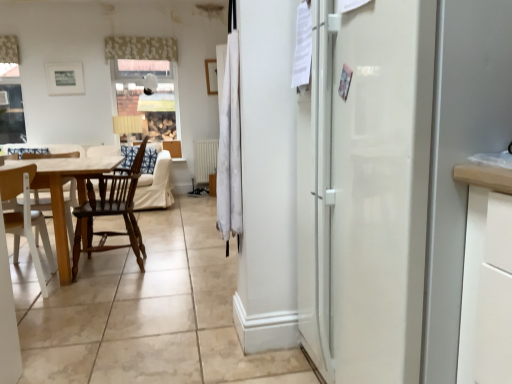
Question: Should I look upward or downward to see white floral fabric at upper center, acting as the second curtain starting from the front?

Choices:
 (A) down
 (B) up

Answer: (B)

Question: Can you confirm if wooden table at left is bigger than dark brown wood chair at left, which ranks as the 2th chair in left-to-right order?

Choices:
 (A) yes
 (B) no

Answer: (A)

Question: Is wooden table at left facing towards dark brown wood chair at left, which ranks as the 2th chair in left-to-right order?

Choices:
 (A) yes
 (B) no

Answer: (B)

Question: Is the position of wooden table at left less distant than that of dark brown wood chair at left, which ranks as the 2th chair in left-to-right order?

Choices:
 (A) yes
 (B) no

Answer: (A)

Question: Considering the relative sizes of wooden table at left and dark brown wood chair at left, arranged as the 1th chair when viewed from the right, in the image provided, is wooden table at left thinner than dark brown wood chair at left, arranged as the 1th chair when viewed from the right,?

Choices:
 (A) no
 (B) yes

Answer: (A)

Question: Does wooden table at left have a lesser height compared to dark brown wood chair at left, arranged as the 1th chair when viewed from the right?

Choices:
 (A) yes
 (B) no

Answer: (A)

Question: Considering the relative sizes of wooden table at left and dark brown wood chair at left, which ranks as the 2th chair in left-to-right order, in the image provided, is wooden table at left wider than dark brown wood chair at left, which ranks as the 2th chair in left-to-right order,?

Choices:
 (A) no
 (B) yes

Answer: (B)

Question: Is wooden table at left to the left of white wood chair at lower left, positioned as the 1th chair in left-to-right order, from the viewer's perspective?

Choices:
 (A) yes
 (B) no

Answer: (A)

Question: Is wooden table at left bigger than white wood chair at lower left, positioned as the 1th chair in left-to-right order?

Choices:
 (A) no
 (B) yes

Answer: (B)

Question: Considering the relative sizes of wooden table at left and white wood chair at lower left, the second chair viewed from the right, in the image provided, is wooden table at left thinner than white wood chair at lower left, the second chair viewed from the right,?

Choices:
 (A) yes
 (B) no

Answer: (B)

Question: Is wooden table at left closer to the viewer compared to white wood chair at lower left, the second chair viewed from the right?

Choices:
 (A) yes
 (B) no

Answer: (B)

Question: From the image's perspective, is wooden table at left beneath white wood chair at lower left, the second chair viewed from the right?

Choices:
 (A) yes
 (B) no

Answer: (B)

Question: Is white wood chair at lower left, the second chair viewed from the right, inside wooden table at left?

Choices:
 (A) yes
 (B) no

Answer: (A)

Question: Considering the relative sizes of white fabric curtain at center, placed as the first curtain when sorted from right to left, and dark brown wood chair at left, which ranks as the 2th chair in left-to-right order, in the image provided, is white fabric curtain at center, placed as the first curtain when sorted from right to left, thinner than dark brown wood chair at left, which ranks as the 2th chair in left-to-right order,?

Choices:
 (A) yes
 (B) no

Answer: (A)